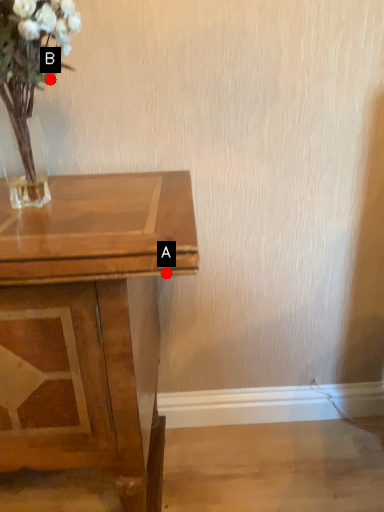
Question: Two points are circled on the image, labeled by A and B beside each circle. Which point is closer to the camera taking this photo?

Choices:
 (A) A is closer
 (B) B is closer

Answer: (A)